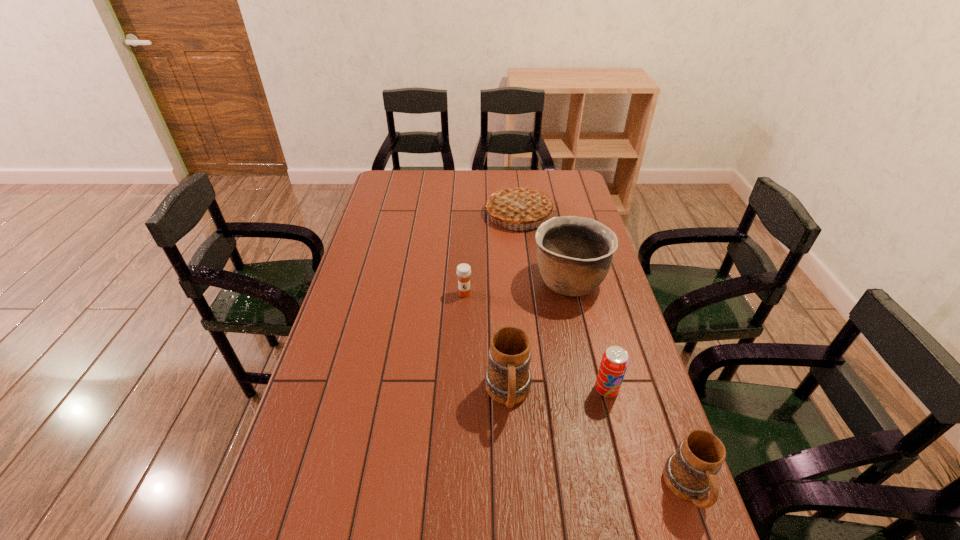
Where is `object that is positioned at the far right corner`? This screenshot has height=540, width=960. object that is positioned at the far right corner is located at coordinates (517, 204).

Locate an element on the screen. This screenshot has width=960, height=540. object that is positioned at the near right corner is located at coordinates (689, 473).

Locate an element on the screen. This screenshot has width=960, height=540. vacant point at the far edge is located at coordinates pyautogui.click(x=502, y=180).

Identify the location of vacant space at the near edge of the desktop. The width and height of the screenshot is (960, 540). pyautogui.click(x=444, y=515).

Image resolution: width=960 pixels, height=540 pixels. In the image, there is a desktop. In order to click on vacant space at the left edge in this screenshot , I will do `click(359, 322)`.

In the image, there is a desktop. What are the coordinates of `vacant space at the right edge` in the screenshot? It's located at (586, 211).

Find the location of a particular element. The width and height of the screenshot is (960, 540). vacant space at the far left corner is located at coordinates (381, 193).

The height and width of the screenshot is (540, 960). What are the coordinates of `vacant point located between the pie and the medicine` in the screenshot? It's located at (492, 254).

Where is `vacant space that is in between the farthest object and the nearest object`? vacant space that is in between the farthest object and the nearest object is located at coordinates (603, 352).

Identify the location of blank region between the nearest object and the farther mug. The width and height of the screenshot is (960, 540). (598, 442).